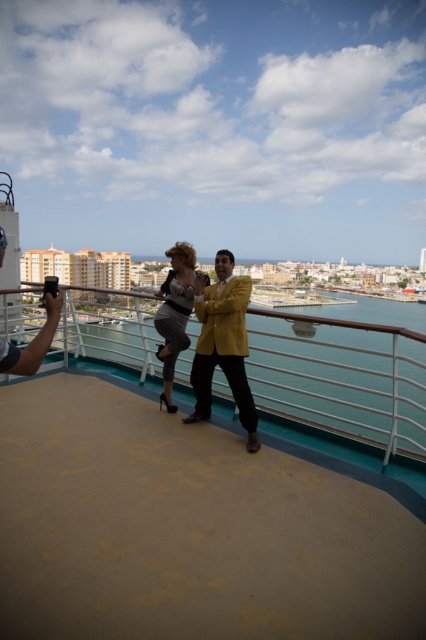
Does blue glossy water at center have a greater height compared to shiny yellow blazer at center?

Yes.

Describe the element at coordinates (342, 378) in the screenshot. This screenshot has width=426, height=640. I see `blue glossy water at center` at that location.

Where is `blue glossy water at center`? blue glossy water at center is located at coordinates (342, 378).

Locate an element on the screen. blue glossy water at center is located at coordinates (342, 378).

Between smooth tan deck at center and shiny yellow blazer at center, which one is positioned lower?

smooth tan deck at center

The height and width of the screenshot is (640, 426). What are the coordinates of `smooth tan deck at center` in the screenshot? It's located at (187, 529).

The width and height of the screenshot is (426, 640). In order to click on smooth tan deck at center in this screenshot , I will do `click(187, 529)`.

Between smooth tan deck at center and blue glossy water at center, which one is positioned lower?

smooth tan deck at center is below.

How distant is smooth tan deck at center from blue glossy water at center?

smooth tan deck at center and blue glossy water at center are 36.59 meters apart.

Does point (256, 513) come farther from viewer compared to point (408, 392)?

No, (256, 513) is closer to viewer.

What are the coordinates of `smooth tan deck at center` in the screenshot? It's located at (187, 529).